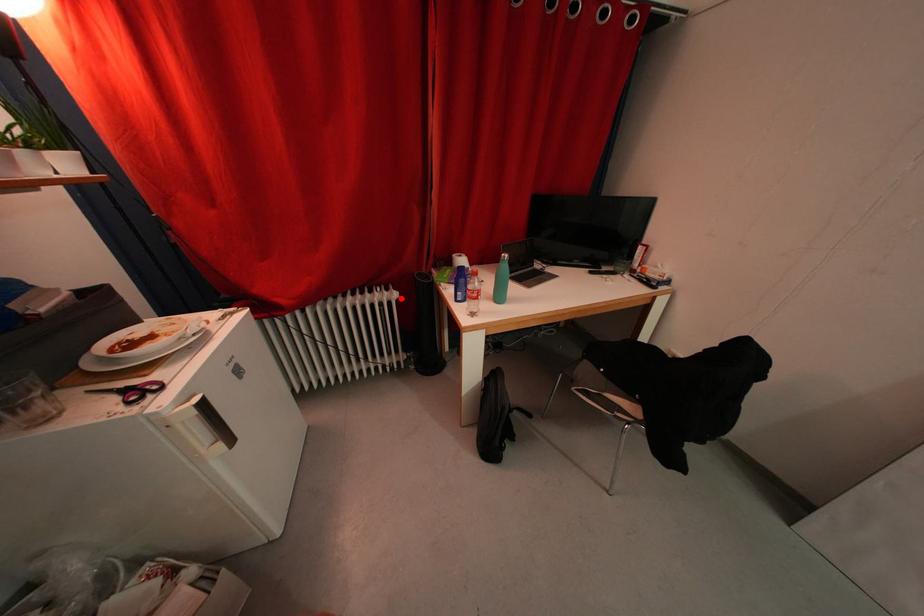
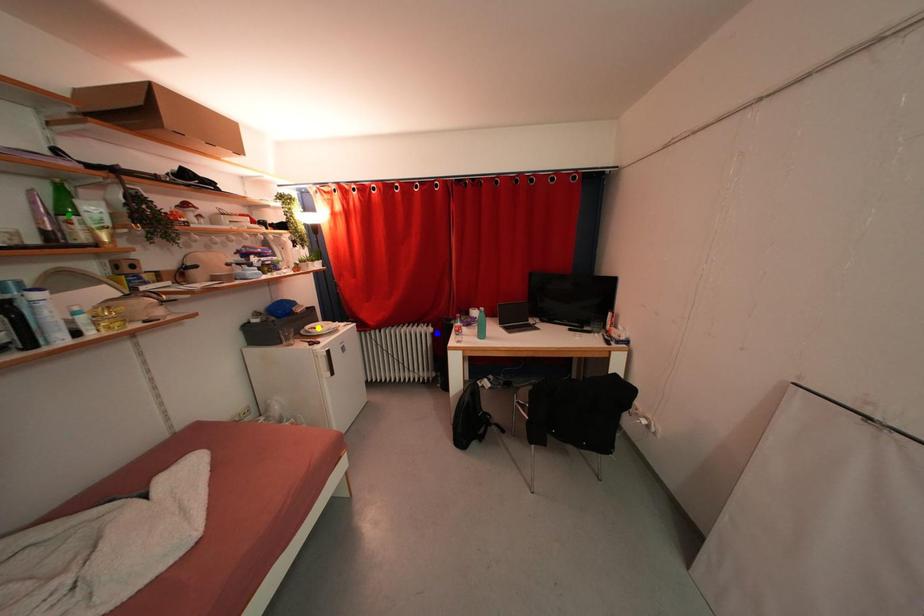
Question: I am providing you with two images of the same scene from different viewpoints. A red point is marked on the first image. You are given multiple points on the second image. In image 2, which mark is for the same physical point as the one in image 1?

Choices:
 (A) green point
 (B) blue point
 (C) yellow point

Answer: (B)